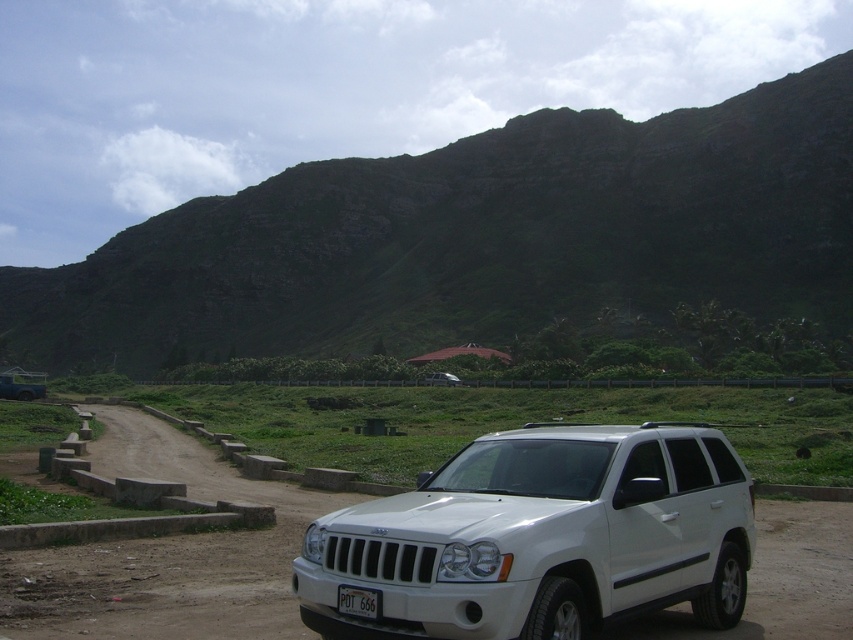
Question: Among these objects, which one is nearest to the camera?

Choices:
 (A) white matte suv at center
 (B) white plastic license plate at center
 (C) green rocky mountain at upper center
 (D) white matte jeep at lower center

Answer: (A)

Question: Which object is closer to the camera taking this photo?

Choices:
 (A) white plastic license plate at center
 (B) green rocky mountain at upper center
 (C) white matte jeep at lower center
 (D) white matte suv at center

Answer: (D)

Question: Is white matte suv at center closer to camera compared to white matte jeep at lower center?

Choices:
 (A) yes
 (B) no

Answer: (A)

Question: Is white matte suv at center thinner than white plastic license plate at center?

Choices:
 (A) yes
 (B) no

Answer: (B)

Question: Is white matte suv at center smaller than white matte jeep at lower center?

Choices:
 (A) no
 (B) yes

Answer: (B)

Question: Which point is farther to the camera?

Choices:
 (A) (33, 390)
 (B) (376, 618)

Answer: (A)